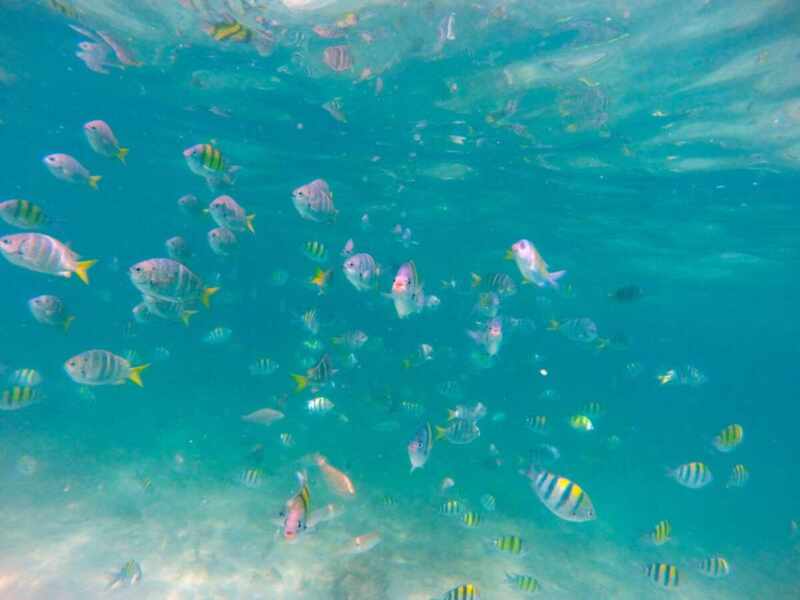
You are a GUI agent. You are given a task and a screenshot of the screen. Output one action in this format:
    pyautogui.click(x=<x>, y=<y>)
    Task: Click on the floor
    The height and width of the screenshot is (600, 800).
    Given the screenshot: What is the action you would take?
    pos(165,575)